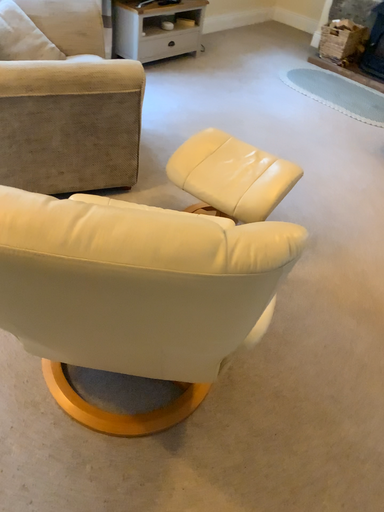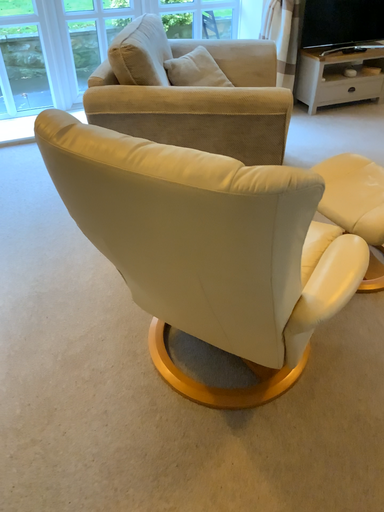
Question: How did the camera likely rotate when shooting the video?

Choices:
 (A) rotated downward
 (B) rotated upward

Answer: (B)